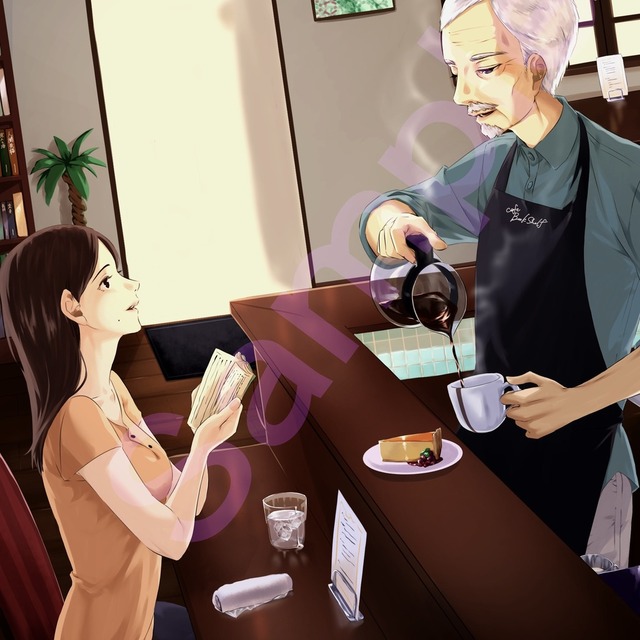
The image size is (640, 640). Identify the location of napkin. (246, 576).